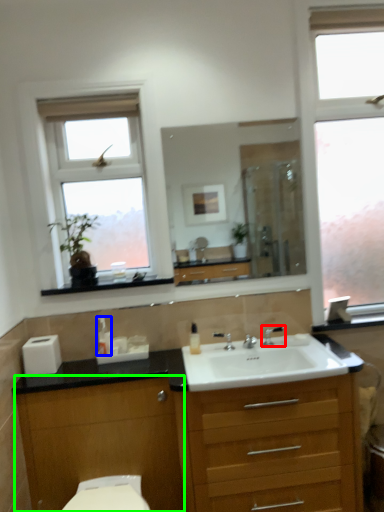
Question: Which is nearer to the tap (highlighted by a red box)? soap dispenser (highlighted by a blue box) or cabinetry (highlighted by a green box).

Choices:
 (A) soap dispenser
 (B) cabinetry

Answer: (A)